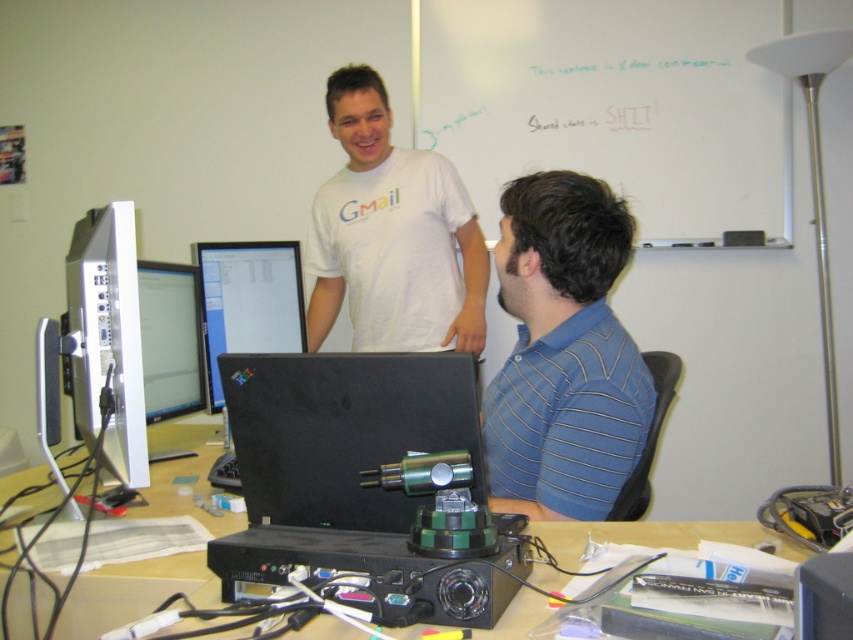
Who is positioned more to the left, white glossy gmail t-shirt at upper center or black plastic table at center?

From the viewer's perspective, black plastic table at center appears more on the left side.

Can you confirm if white glossy gmail t-shirt at upper center is positioned below black plastic table at center?

No.

Is point (340, 138) positioned behind point (792, 547)?

Yes, it is behind point (792, 547).

You are a GUI agent. You are given a task and a screenshot of the screen. Output one action in this format:
    pyautogui.click(x=<x>, y=<y>)
    Task: Click on the white glossy gmail t-shirt at upper center
    
    Given the screenshot: What is the action you would take?
    pyautogui.click(x=392, y=234)

Consider the image. Does blue striped shirt at right have a smaller size compared to white glossy monitor at left?

Incorrect, blue striped shirt at right is not smaller in size than white glossy monitor at left.

Identify the location of blue striped shirt at right. The height and width of the screenshot is (640, 853). (563, 353).

Which is behind, point (579, 344) or point (196, 333)?

Point (196, 333)

Which is above, blue striped shirt at right or matte black monitor at left?

blue striped shirt at right

Who is more forward, (x=543, y=349) or (x=190, y=305)?

Point (x=543, y=349) is in front.

Identify the location of blue striped shirt at right. (563, 353).